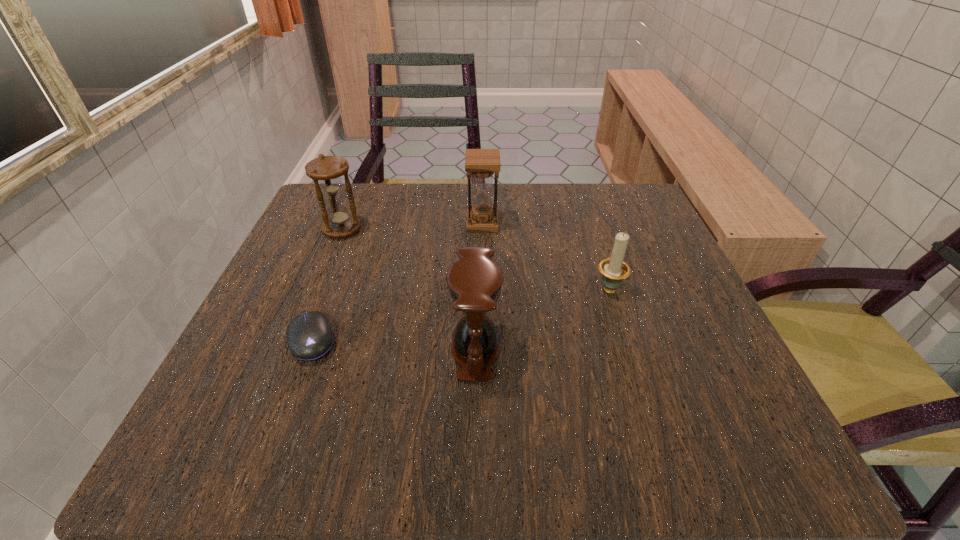
Where is `vacant space located 0.080m on the front of the computer mouse`? vacant space located 0.080m on the front of the computer mouse is located at coordinates [x=284, y=413].

Where is `hourglass positioned at the left edge`? The height and width of the screenshot is (540, 960). hourglass positioned at the left edge is located at coordinates (326, 171).

At what (x,y) coordinates should I click in order to perform the action: click on computer mouse located at the left edge. Please return your answer as a coordinate pair (x, y). The width and height of the screenshot is (960, 540). Looking at the image, I should click on tap(309, 336).

The width and height of the screenshot is (960, 540). Identify the location of object positioned at the right edge. (614, 270).

Find the location of `object located in the far left corner section of the desktop`. object located in the far left corner section of the desktop is located at coordinates (326, 171).

The image size is (960, 540). What are the coordinates of `free region at the far edge of the desktop` in the screenshot? It's located at (437, 234).

Identify the location of vacant space at the near edge of the desktop. (447, 417).

Locate an element on the screen. free point at the left edge is located at coordinates (320, 386).

Locate an element on the screen. The image size is (960, 540). vacant space at the far left corner of the desktop is located at coordinates (361, 224).

Locate an element on the screen. The image size is (960, 540). free space at the near left corner of the desktop is located at coordinates (179, 450).